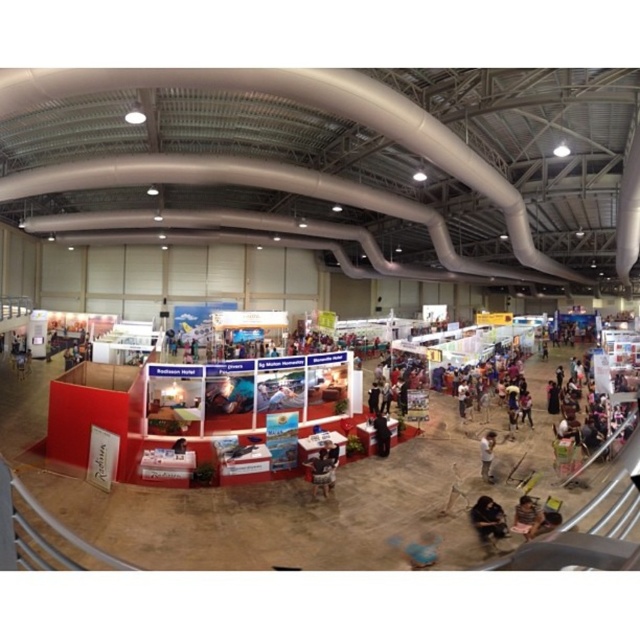
Who is higher up, dark fabric bag at lower right or dark brown leather jacket at lower right?

dark brown leather jacket at lower right is above.

Who is shorter, dark fabric bag at lower right or dark brown leather jacket at lower right?

dark fabric bag at lower right is shorter.

Locate an element on the screen. dark fabric bag at lower right is located at coordinates (486, 522).

Which is more to the left, dark fabric bag at lower right or brown leather jacket at center?

From the viewer's perspective, brown leather jacket at center appears more on the left side.

Can you confirm if dark fabric bag at lower right is shorter than brown leather jacket at center?

Yes, dark fabric bag at lower right is shorter than brown leather jacket at center.

Between point (499, 506) and point (330, 474), which one is positioned in front?

Point (499, 506) is more forward.

Identify the location of dark fabric bag at lower right. (486, 522).

Which of these two, brown leather jacket at center or dark brown leather jacket at lower right, stands shorter?

Standing shorter between the two is brown leather jacket at center.

What do you see at coordinates (323, 472) in the screenshot? I see `brown leather jacket at center` at bounding box center [323, 472].

Describe the element at coordinates (323, 472) in the screenshot. The height and width of the screenshot is (640, 640). I see `brown leather jacket at center` at that location.

Find the location of a particular element. brown leather jacket at center is located at coordinates (323, 472).